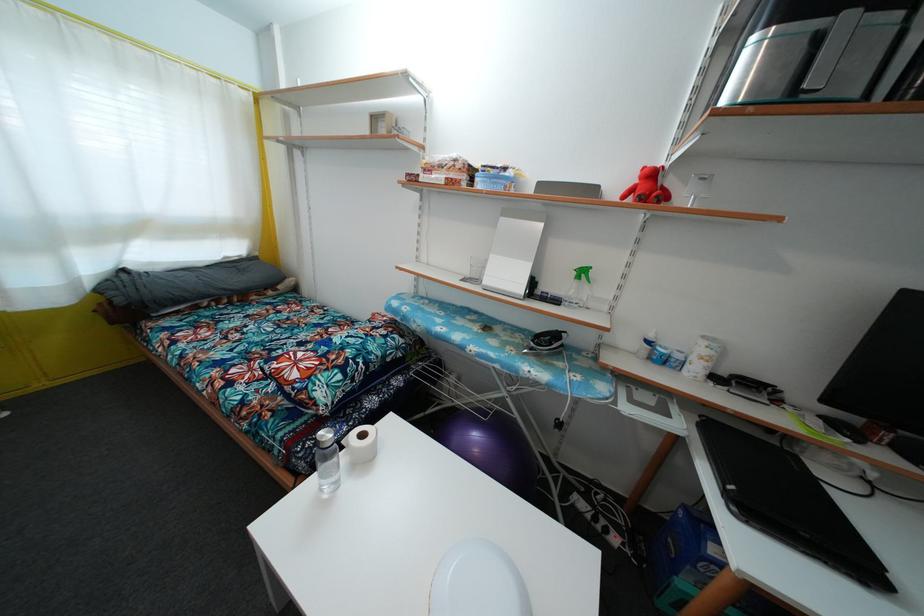
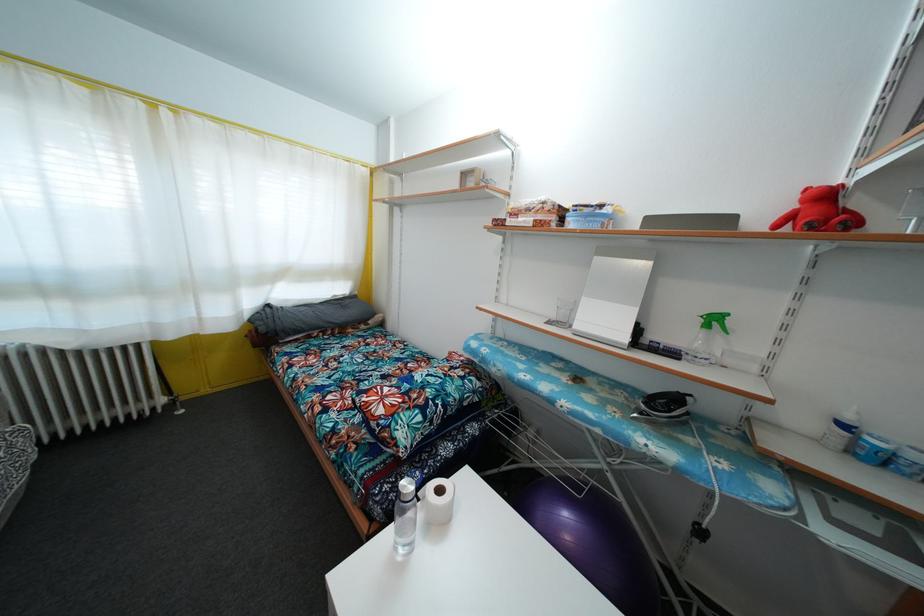
Find the pixel in the second image that matches (563,431) in the first image.

(704, 540)